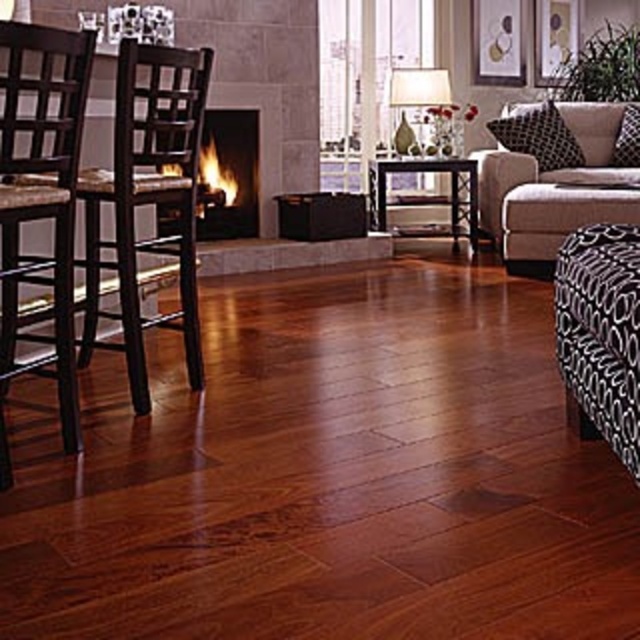
Can you confirm if matte dark wood chair at left is positioned to the left of matte brown wood chair at left?

Indeed, matte dark wood chair at left is positioned on the left side of matte brown wood chair at left.

Does point (163, 76) lie in front of point (60, 262)?

No, (163, 76) is further to viewer.

Locate an element on the screen. This screenshot has width=640, height=640. matte dark wood chair at left is located at coordinates coord(148,200).

Which is more to the left, matte brown wood chair at left or matte black fireplace at center?

From the viewer's perspective, matte brown wood chair at left appears more on the left side.

Does matte brown wood chair at left appear on the left side of matte black fireplace at center?

Indeed, matte brown wood chair at left is positioned on the left side of matte black fireplace at center.

Describe the element at coordinates (40, 202) in the screenshot. I see `matte brown wood chair at left` at that location.

The width and height of the screenshot is (640, 640). Identify the location of matte brown wood chair at left. (40, 202).

Can you confirm if matte black fireplace at center is positioned below white fabric lampshade at upper center?

Yes, matte black fireplace at center is below white fabric lampshade at upper center.

Which is below, matte black fireplace at center or white fabric lampshade at upper center?

matte black fireplace at center is lower down.

Describe the element at coordinates (228, 173) in the screenshot. I see `matte black fireplace at center` at that location.

I want to click on matte black fireplace at center, so point(228,173).